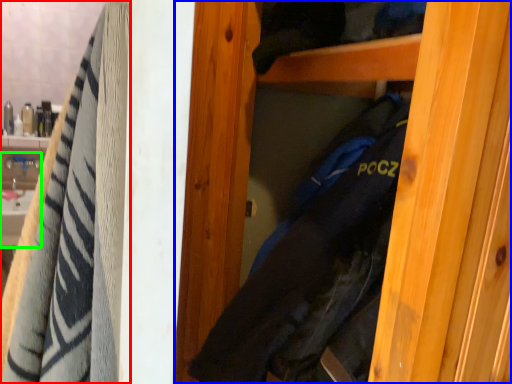
Question: Based on their relative distances, which object is nearer to towel (highlighted by a red box)? Choose from door (highlighted by a blue box) and sink (highlighted by a green box).

Choices:
 (A) door
 (B) sink

Answer: (A)